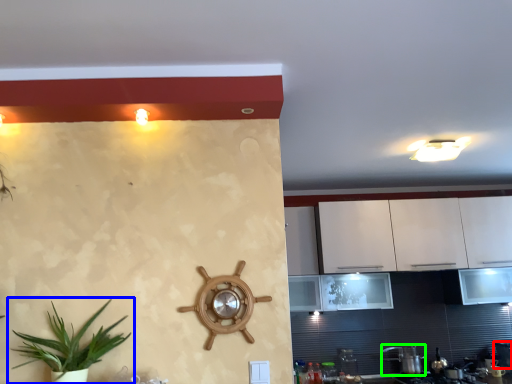
Question: Which is nearer to the appliance (highlighted by a red box)? houseplant (highlighted by a blue box) or appliance (highlighted by a green box).

Choices:
 (A) houseplant
 (B) appliance

Answer: (B)